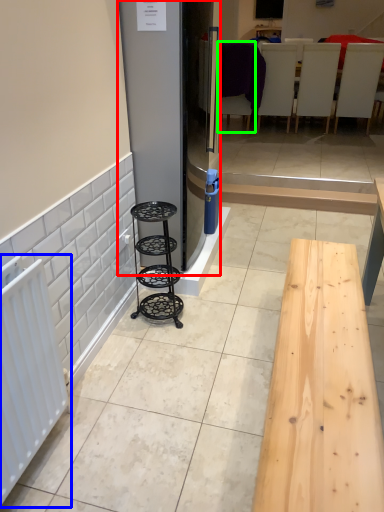
Question: Considering the real-world distances, which object is farthest from fridge (highlighted by a red box)? radiator (highlighted by a blue box) or furniture (highlighted by a green box)?

Choices:
 (A) radiator
 (B) furniture

Answer: (B)